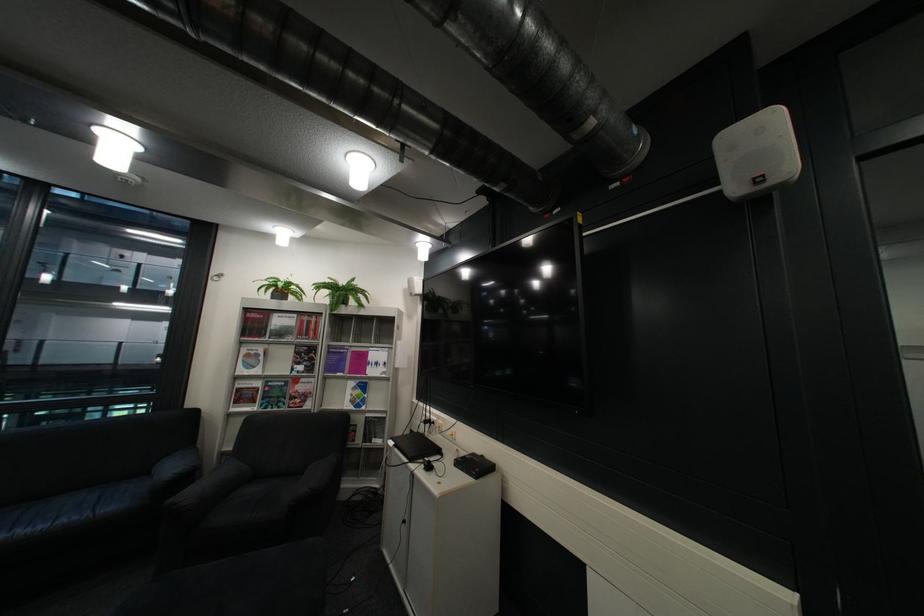
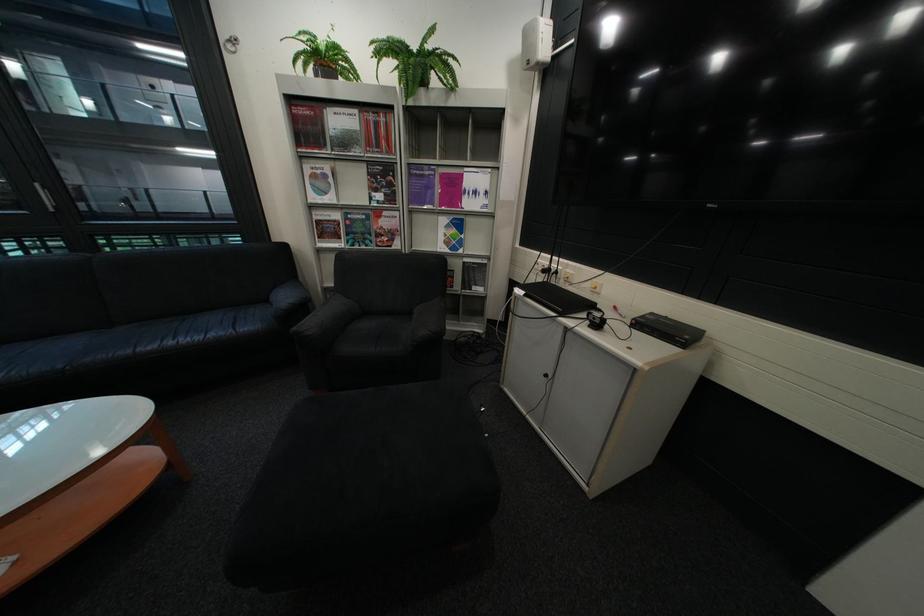
Locate, in the second image, the point that corresponds to pixel 444 421 in the first image.

(563, 270)